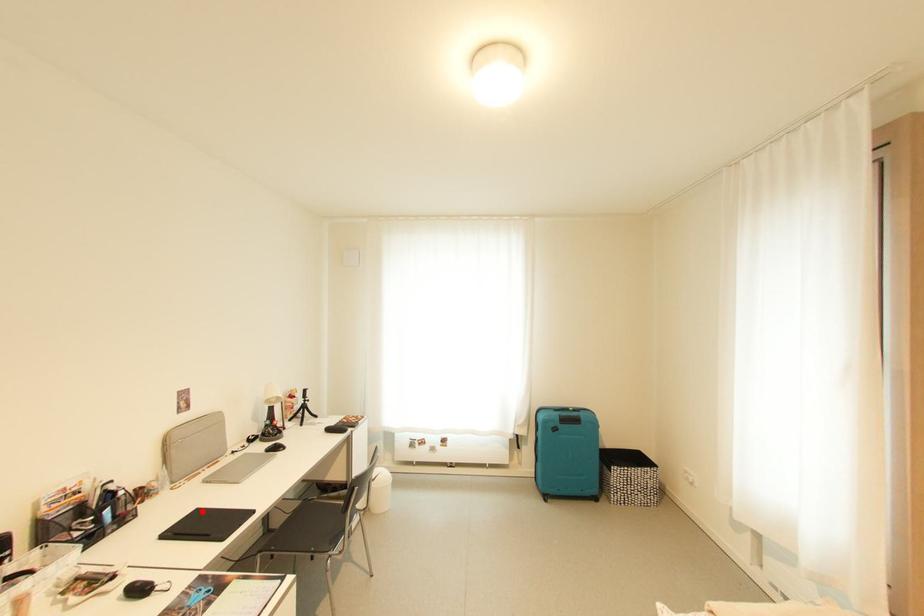
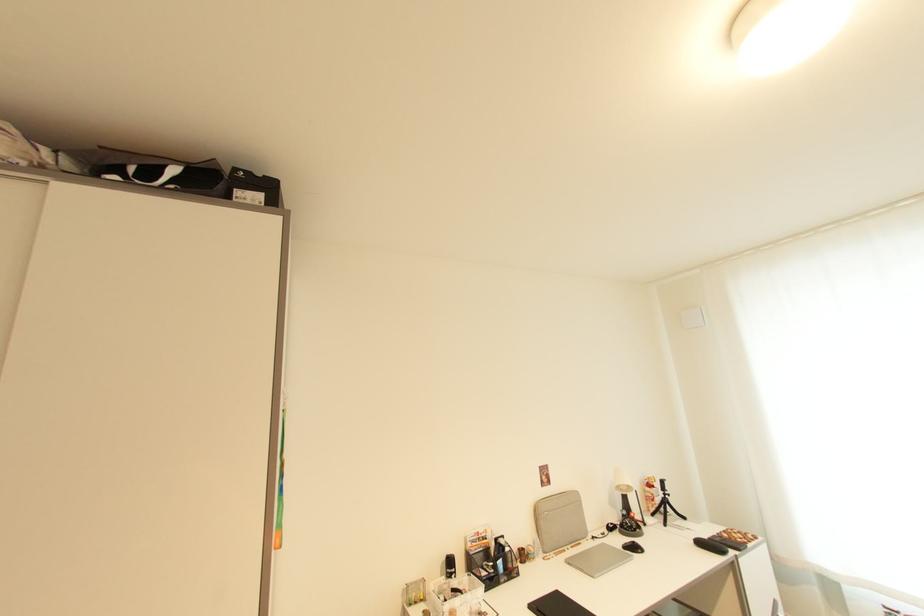
The point at the highlighted location is marked in the first image. Where is the corresponding point in the second image?

(562, 594)